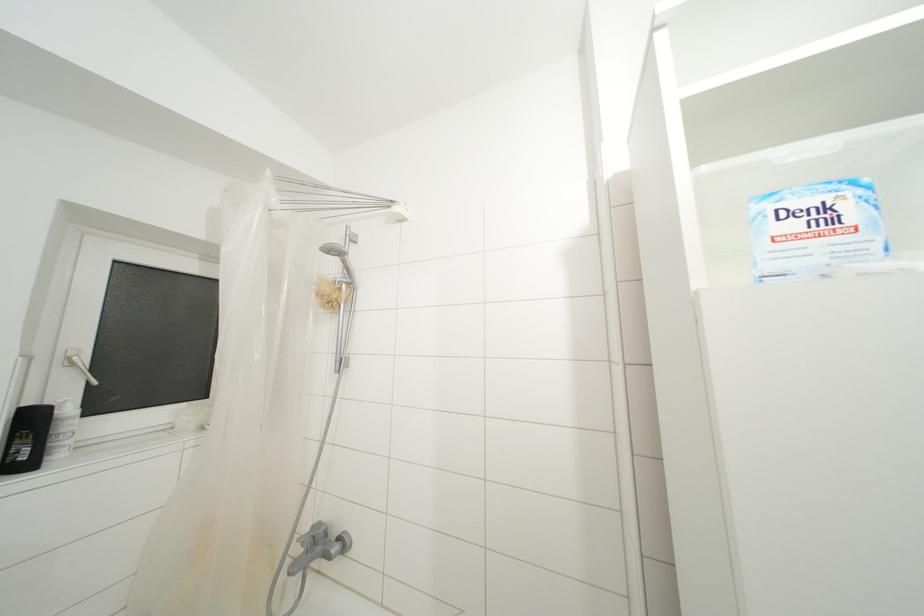
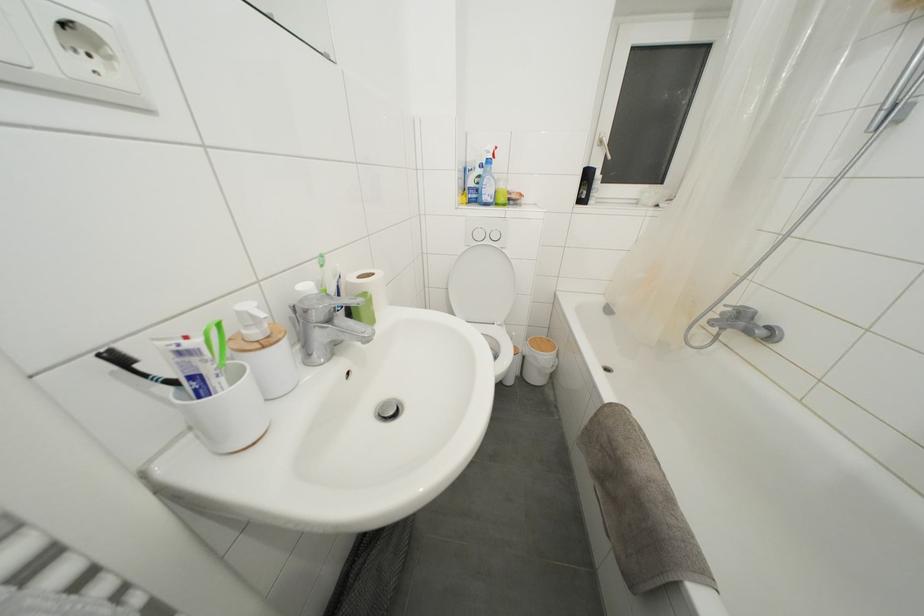
The point at (35, 424) is marked in the first image. Where is the corresponding point in the second image?

(591, 180)